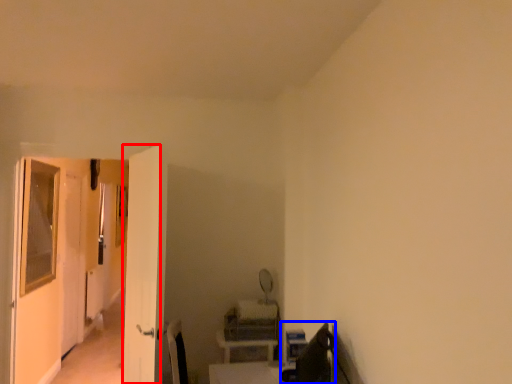
Question: Which object appears closest to the camera in this image, screen door (highlighted by a red box) or swivel chair (highlighted by a blue box)?

Choices:
 (A) screen door
 (B) swivel chair

Answer: (B)